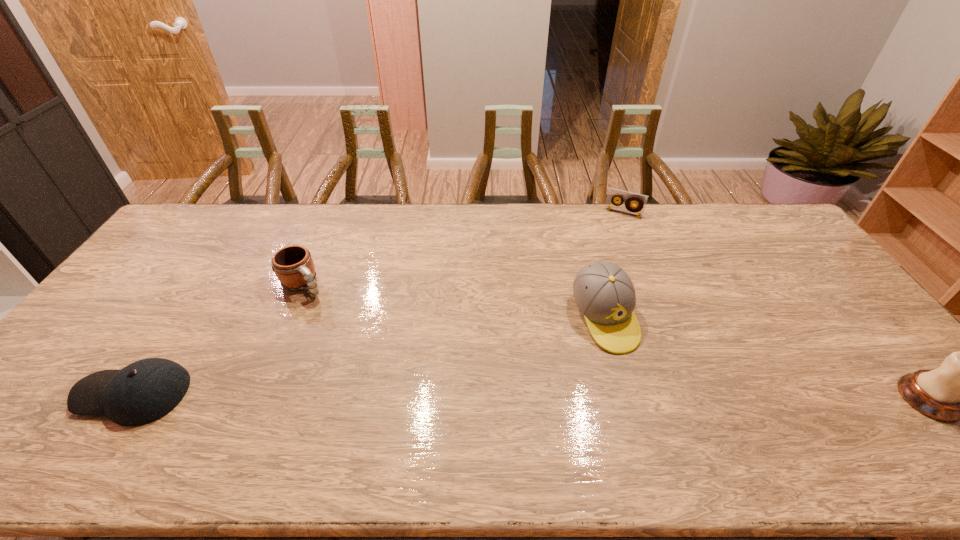
Locate an element on the screen. Image resolution: width=960 pixels, height=540 pixels. free space at the far edge of the desktop is located at coordinates (348, 233).

Where is `vacant area at the near edge`? The height and width of the screenshot is (540, 960). vacant area at the near edge is located at coordinates (567, 411).

Find the location of a particular element. free location at the left edge of the desktop is located at coordinates (169, 293).

Locate an element on the screen. This screenshot has height=540, width=960. free space at the right edge of the desktop is located at coordinates (804, 287).

Image resolution: width=960 pixels, height=540 pixels. In the image, there is a desktop. What are the coordinates of `free space at the far right corner` in the screenshot? It's located at (776, 232).

At what (x,y) coordinates should I click in order to perform the action: click on empty location between the second object from right to left and the shorter baseball cap. Please return your answer as a coordinate pair (x, y). This screenshot has width=960, height=540. Looking at the image, I should click on (378, 303).

Identify the location of vacant area that lies between the fourth object from right to left and the leftmost object. (218, 340).

Identify the location of empty location between the fourth object from right to left and the nearer baseball cap. The image size is (960, 540). (218, 340).

At what (x,y) coordinates should I click in order to perform the action: click on empty space that is in between the third object from left to right and the fourth object from right to left. Please return your answer as a coordinate pair (x, y). The width and height of the screenshot is (960, 540). Looking at the image, I should click on (453, 302).

This screenshot has height=540, width=960. What are the coordinates of `free space that is in between the mug and the shorter baseball cap` in the screenshot? It's located at (218, 340).